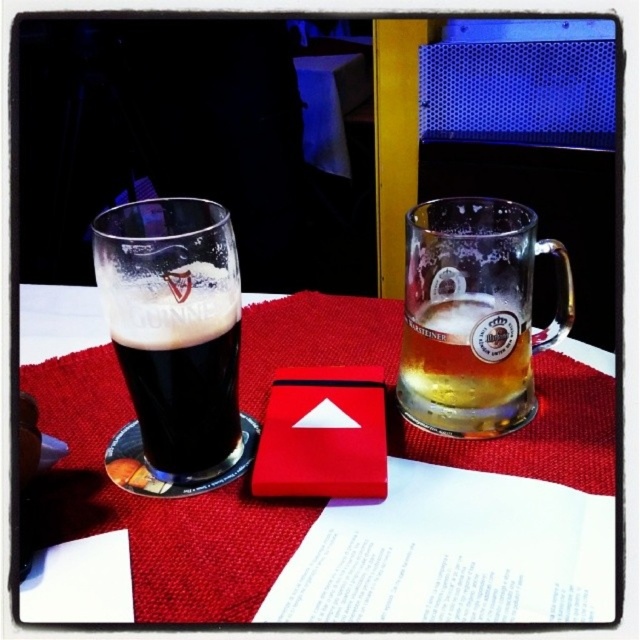
Question: Can you confirm if red fabric placemat at center is bigger than dark glass at left?

Choices:
 (A) yes
 (B) no

Answer: (A)

Question: Which of the following is the closest to the observer?

Choices:
 (A) (97, 560)
 (B) (468, 404)
 (C) (508, 369)

Answer: (A)

Question: Among these points, which one is farthest from the camera?

Choices:
 (A) (125, 256)
 (B) (432, 305)

Answer: (B)

Question: Which object is positioned farthest from the translucent glass mug at center?

Choices:
 (A) dark glass at left
 (B) translucent glass mug at upper right

Answer: (A)

Question: Can you confirm if red fabric placemat at center is positioned below dark glass at left?

Choices:
 (A) yes
 (B) no

Answer: (A)

Question: Is dark glass at left in front of translucent glass mug at center?

Choices:
 (A) yes
 (B) no

Answer: (A)